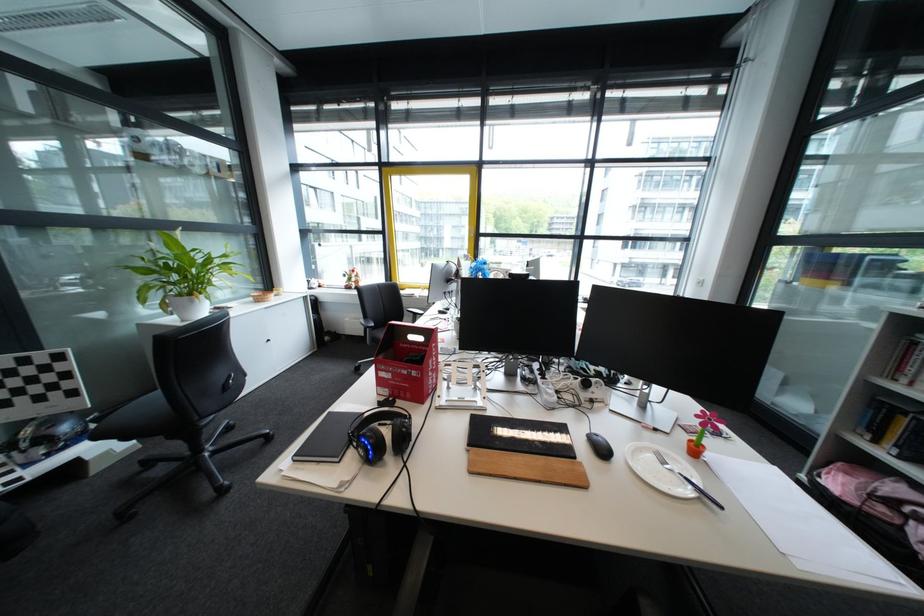
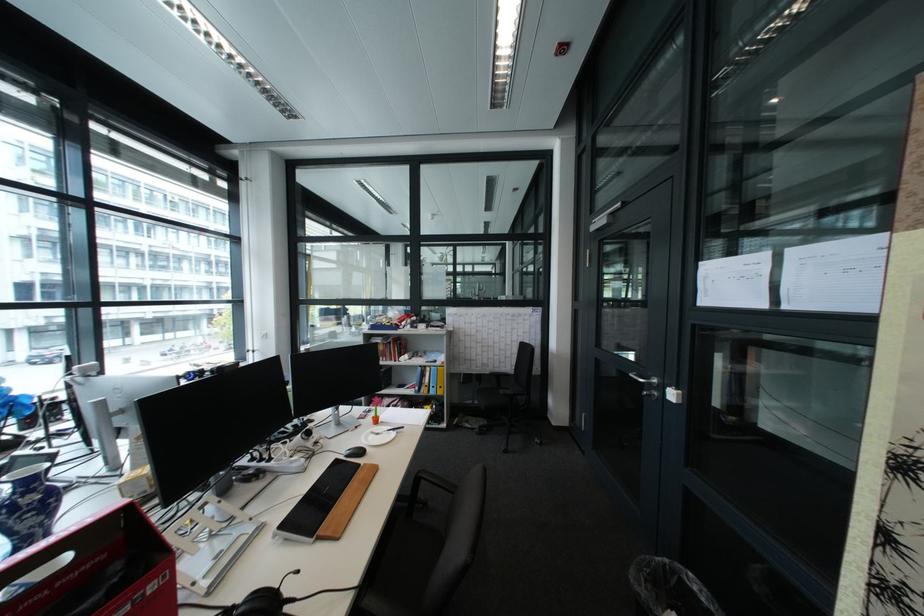
Question: The first image is from the beginning of the video and the second image is from the end. How did the camera likely rotate when shooting the video?

Choices:
 (A) Left
 (B) Right
 (C) Up
 (D) Down

Answer: (B)